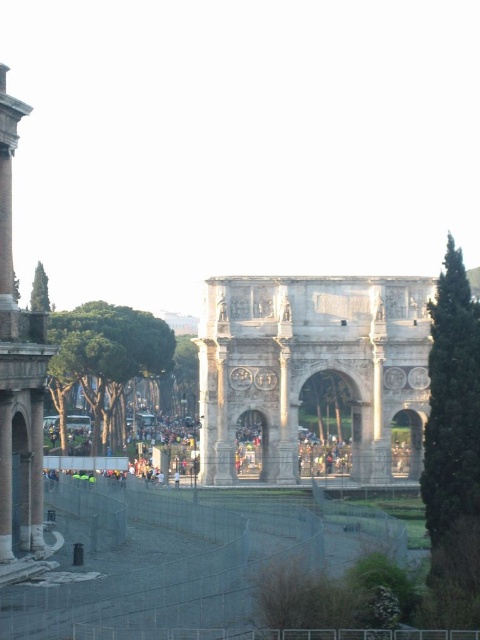
You are standing on the viewing platform in front of the Arch of Constantine. You see the smooth stone column at left and the white marble arch at center. Which object is positioned higher relative to the other?

The smooth stone column at left is located above the white marble arch at center, so it is positioned higher.

Consider the image. You are standing at the Arch of Constantine in Rome and want to take a photo of the point at coordinates (x=13, y=360). The camera you are using has a maximum focus range of 100 meters. Will the camera be able to focus on that point?

The point at coordinates (x=13, y=360) is 105.85 meters away from the camera, which exceeds the maximum focus range of 100 meters. Therefore, the camera will not be able to focus on that point.